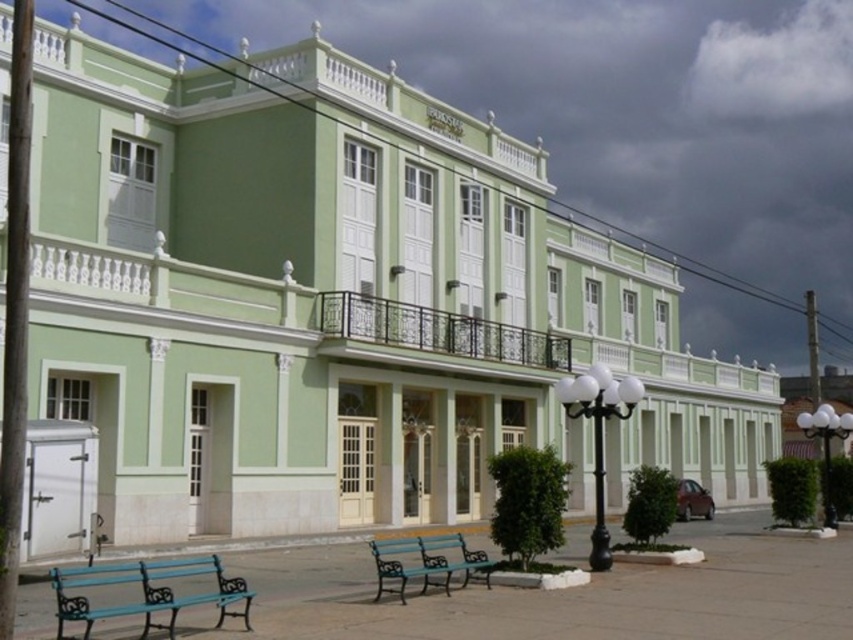
Question: Observing the image, what is the correct spatial positioning of teal painted wood bench at lower left in reference to black metal streetlight at center?

Choices:
 (A) below
 (B) above

Answer: (A)

Question: Among these points, which one is farthest from the camera?

Choices:
 (A) (595, 552)
 (B) (76, 620)

Answer: (A)

Question: Does teal painted wood bench at center lie behind white glass lamp post at right?

Choices:
 (A) no
 (B) yes

Answer: (A)

Question: Does black metal streetlight at center have a greater width compared to white glass lamp post at right?

Choices:
 (A) no
 (B) yes

Answer: (A)

Question: Estimate the real-world distances between objects in this image. Which object is closer to the dark gray cloud at upper center?

Choices:
 (A) black metal streetlight at center
 (B) teal painted wood bench at lower left
 (C) teal painted wood bench at center
 (D) white glass lamp post at right

Answer: (D)

Question: Which is nearer to the black metal streetlight at center?

Choices:
 (A) teal painted wood bench at center
 (B) teal painted wood bench at lower left
 (C) white glass lamp post at right
 (D) dark gray cloud at upper center

Answer: (A)